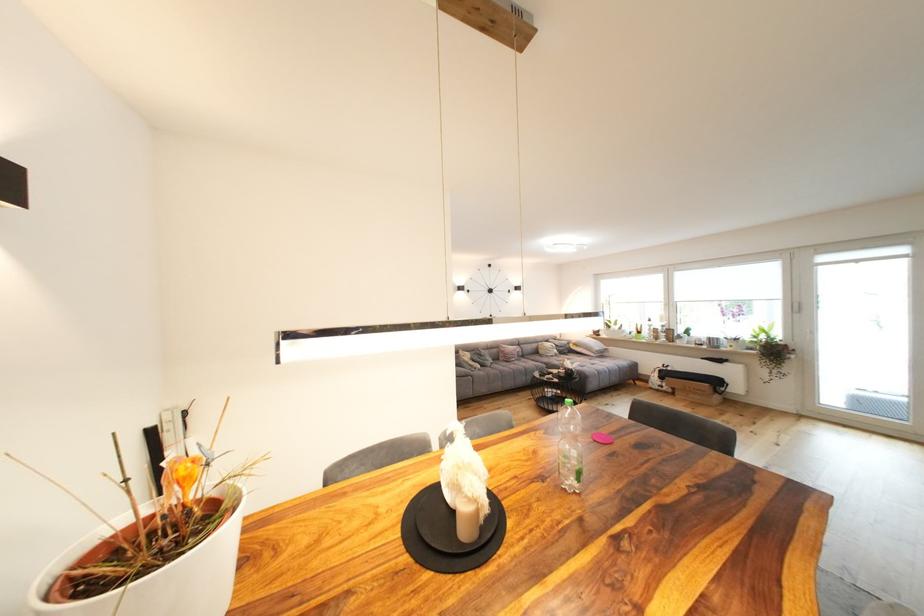
I want to click on light colored pillow, so click(588, 346).